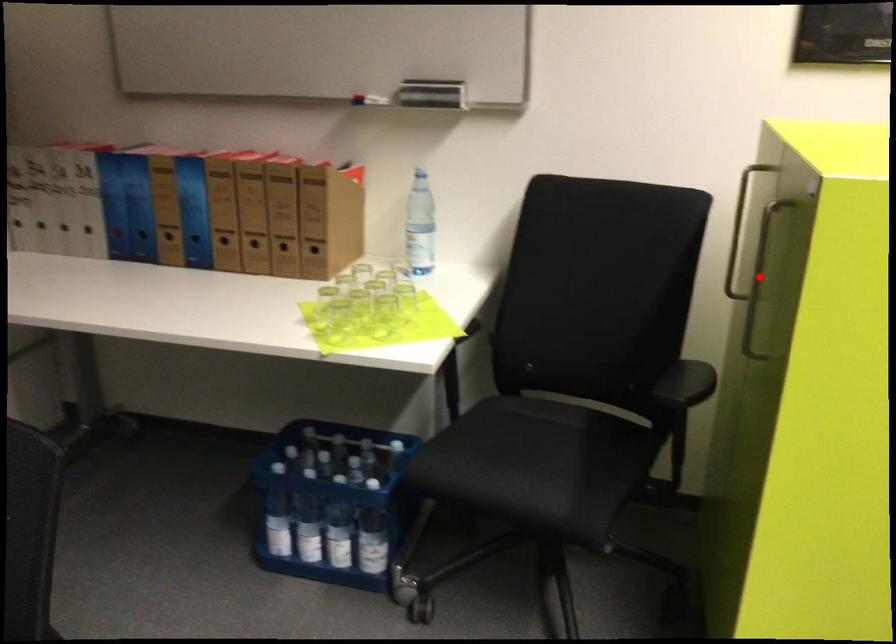
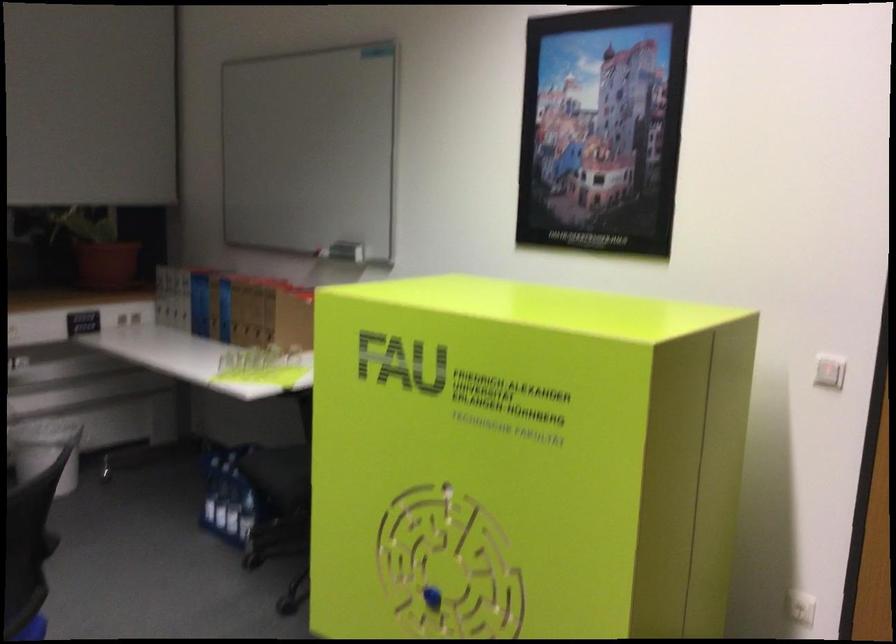
Question: I am providing you with two images of the same scene from different viewpoints. A red point is marked on the first image. Is the red point's position out of view in image 2?

Choices:
 (A) Yes
 (B) No

Answer: (A)